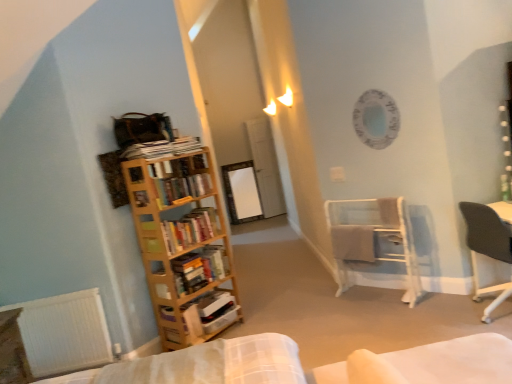
In order to face white metal towel rack at center right, should I rotate leftwards or rightwards?

Turn right by 15.082 degrees to look at white metal towel rack at center right.

Where is `dark gray fabric chair at right`? dark gray fabric chair at right is located at coordinates [x=487, y=247].

Describe the element at coordinates (265, 166) in the screenshot. I see `transparent glass door at center` at that location.

I want to click on transparent glass door at center, so click(265, 166).

You are a GUI agent. You are given a task and a screenshot of the screen. Output one action in this format:
    pyautogui.click(x=<x>, y=<y>)
    Task: Click on the wooden bookcase at left
    Image resolution: width=512 pixels, height=384 pixels.
    Given the screenshot: What is the action you would take?
    pyautogui.click(x=183, y=246)

Image resolution: width=512 pixels, height=384 pixels. Find the location of `white cardboard box at left, which is the 1th book in bottom-to-top order`. white cardboard box at left, which is the 1th book in bottom-to-top order is located at coordinates (209, 312).

This screenshot has width=512, height=384. What do you see at coordinates (199, 269) in the screenshot?
I see `wooden bookshelf at left, the 3th book when ordered from top to bottom` at bounding box center [199, 269].

What do you see at coordinates (64, 332) in the screenshot?
I see `white matte radiator at lower left` at bounding box center [64, 332].

Image resolution: width=512 pixels, height=384 pixels. Identify the location of white metal towel rack at center right. (373, 239).

Consider the image. How many degrees apart are the facing directions of white matte radiator at lower left and wooden bookshelf at left, placed as the 2th book when sorted from bottom to top?

45.7 degrees.

Locate an element on the screen. radiator that appears on the left of wooden bookshelf at left, placed as the 2th book when sorted from bottom to top is located at coordinates (64, 332).

Looking at this image, considering the sizes of objects white matte radiator at lower left and wooden bookshelf at left, placed as the 2th book when sorted from bottom to top, in the image provided, who is thinner, white matte radiator at lower left or wooden bookshelf at left, placed as the 2th book when sorted from bottom to top,?

white matte radiator at lower left is thinner.

In the image, is white matte radiator at lower left positioned in front of or behind wooden bookshelf at left, the 3th book when ordered from top to bottom?

Visually, white matte radiator at lower left is located in front of wooden bookshelf at left, the 3th book when ordered from top to bottom.

Between wooden table at lower left and wooden bookshelf at left, the 3th book when ordered from top to bottom, which one has more height?

wooden table at lower left.

Identify the location of table in front of the wooden bookshelf at left, placed as the 2th book when sorted from bottom to top. (12, 350).

Would you say wooden table at lower left contains wooden bookshelf at left, the 3th book when ordered from top to bottom?

No.

How different are the orientations of white matte radiator at lower left and hardcover books at left, which is the second book in top-to-bottom order, in degrees?

The angular difference between white matte radiator at lower left and hardcover books at left, which is the second book in top-to-bottom order, is 45.7 degrees.

From the image's perspective, is white matte radiator at lower left below hardcover books at left, which is the second book in top-to-bottom order?

Answer: Correct, white matte radiator at lower left appears lower than hardcover books at left, which is the second book in top-to-bottom order, in the image.

From a real-world perspective, between white matte radiator at lower left and hardcover books at left, the 3th book positioned from the bottom, who is vertically higher?

hardcover books at left, the 3th book positioned from the bottom, from a real-world perspective.

Between white matte radiator at lower left and hardcover books at left, which is the second book in top-to-bottom order, which one has less height?

hardcover books at left, which is the second book in top-to-bottom order, is shorter.

Which object is wider, hardcover books at left, which is the second book in top-to-bottom order, or white metal towel rack at center right?

white metal towel rack at center right.

From the picture: Is hardcover books at left, which is the second book in top-to-bottom order, at the left side of white metal towel rack at center right?

Yes, hardcover books at left, which is the second book in top-to-bottom order, is to the left of white metal towel rack at center right.

Is hardcover books at left, the 3th book positioned from the bottom, with white metal towel rack at center right?

No, hardcover books at left, the 3th book positioned from the bottom, is not with white metal towel rack at center right.

What's the angular difference between hardcover books at left, the 3th book positioned from the bottom, and white metal towel rack at center right's facing directions?

There is a 92.1-degree angle between the facing directions of hardcover books at left, the 3th book positioned from the bottom, and white metal towel rack at center right.

Where is `book that is the 2nd one when counting upward from the dark gray fabric chair at right (from the image's perspective)`? book that is the 2nd one when counting upward from the dark gray fabric chair at right (from the image's perspective) is located at coordinates (162, 148).

From a real-world perspective, which object rests below the other?

dark gray fabric chair at right.

Considering the positions of objects dark gray fabric chair at right and wooden bookshelf at left, positioned as the first book in top-to-bottom order, in the image provided, who is in front, dark gray fabric chair at right or wooden bookshelf at left, positioned as the first book in top-to-bottom order,?

dark gray fabric chair at right is closer to the camera.

Is white matte radiator at lower left not close to transparent glass door at center?

white matte radiator at lower left is far away from transparent glass door at center.

This screenshot has width=512, height=384. I want to click on glass door above the white matte radiator at lower left (from the image's perspective), so click(x=265, y=166).

From a real-world perspective, who is located higher, white matte radiator at lower left or transparent glass door at center?

In real-world perspective, transparent glass door at center is above.

From their relative heights in the image, would you say white matte radiator at lower left is taller or shorter than transparent glass door at center?

white matte radiator at lower left is shorter than transparent glass door at center.

Which is behind, white metal towel rack at center right or white matte radiator at lower left?

white metal towel rack at center right is further from the camera.

Is white metal towel rack at center right wider than white matte radiator at lower left?

Yes.

Between point (340, 294) and point (88, 340), which one is positioned in front?

The point (88, 340) is in front.

Which is correct: white metal towel rack at center right is inside white matte radiator at lower left, or outside of it?

white metal towel rack at center right is outside white matte radiator at lower left.

Where is `radiator in front of the wooden bookshelf at left, placed as the 2th book when sorted from bottom to top`? The image size is (512, 384). radiator in front of the wooden bookshelf at left, placed as the 2th book when sorted from bottom to top is located at coordinates click(x=64, y=332).

I want to click on table lying below the wooden bookshelf at left, the 3th book when ordered from top to bottom (from the image's perspective), so click(12, 350).

Consider the image. Estimate the real-world distances between objects in this image. Which object is further from wooden bookshelf at left, placed as the 4th book when sorted from bottom to top, wooden bookshelf at left, placed as the 2th book when sorted from bottom to top, or transparent glass door at center?

transparent glass door at center is positioned further to the anchor wooden bookshelf at left, placed as the 4th book when sorted from bottom to top.

Based on their spatial positions, is wooden bookshelf at left, the 3th book when ordered from top to bottom, or hardcover books at left, which is the second book in top-to-bottom order, closer to wooden table at lower left?

wooden bookshelf at left, the 3th book when ordered from top to bottom, is positioned closer to the anchor wooden table at lower left.

Considering their positions, is dark gray fabric chair at right positioned closer to white metal towel rack at center right than wooden bookshelf at left, placed as the 4th book when sorted from bottom to top?

dark gray fabric chair at right is closer to white metal towel rack at center right.

Considering their positions, is white matte radiator at lower left positioned closer to wooden bookshelf at left, positioned as the first book in top-to-bottom order, than hardcover books at left, which is the second book in top-to-bottom order?

hardcover books at left, which is the second book in top-to-bottom order, is closer to wooden bookshelf at left, positioned as the first book in top-to-bottom order.

From the picture: From the image, which object appears to be farther from wooden bookshelf at left, placed as the 2th book when sorted from bottom to top, wooden table at lower left or white matte radiator at lower left?

wooden table at lower left is further to wooden bookshelf at left, placed as the 2th book when sorted from bottom to top.

Looking at the image, which one is located closer to wooden bookshelf at left, placed as the 4th book when sorted from bottom to top, dark gray fabric chair at right or hardcover books at left, which is the second book in top-to-bottom order?

The object closer to wooden bookshelf at left, placed as the 4th book when sorted from bottom to top, is hardcover books at left, which is the second book in top-to-bottom order.

Estimate the real-world distances between objects in this image. Which object is closer to wooden table at lower left, wooden bookshelf at left, the 3th book when ordered from top to bottom, or transparent glass door at center?

wooden bookshelf at left, the 3th book when ordered from top to bottom, is closer to wooden table at lower left.

Considering their positions, is wooden bookshelf at left, placed as the 4th book when sorted from bottom to top, positioned closer to white cardboard box at left, the fourth book in the top-to-bottom sequence, than dark gray fabric chair at right?

The object closer to white cardboard box at left, the fourth book in the top-to-bottom sequence, is wooden bookshelf at left, placed as the 4th book when sorted from bottom to top.

Image resolution: width=512 pixels, height=384 pixels. Identify the location of bookcase located between wooden table at lower left and white cardboard box at left, which is the 1th book in bottom-to-top order, in the left-right direction. (183, 246).

You are a GUI agent. You are given a task and a screenshot of the screen. Output one action in this format:
    pyautogui.click(x=<x>, y=<y>)
    Task: Click on the bookcase between white matte radiator at lower left and wooden bookshelf at left, the 3th book when ordered from top to bottom, from left to right
    
    Given the screenshot: What is the action you would take?
    pyautogui.click(x=183, y=246)

The width and height of the screenshot is (512, 384). I want to click on radiator between wooden table at lower left and white metal towel rack at center right, so click(64, 332).

The width and height of the screenshot is (512, 384). What are the coordinates of `shelf between white matte radiator at lower left and dark gray fabric chair at right` in the screenshot? It's located at (373, 239).